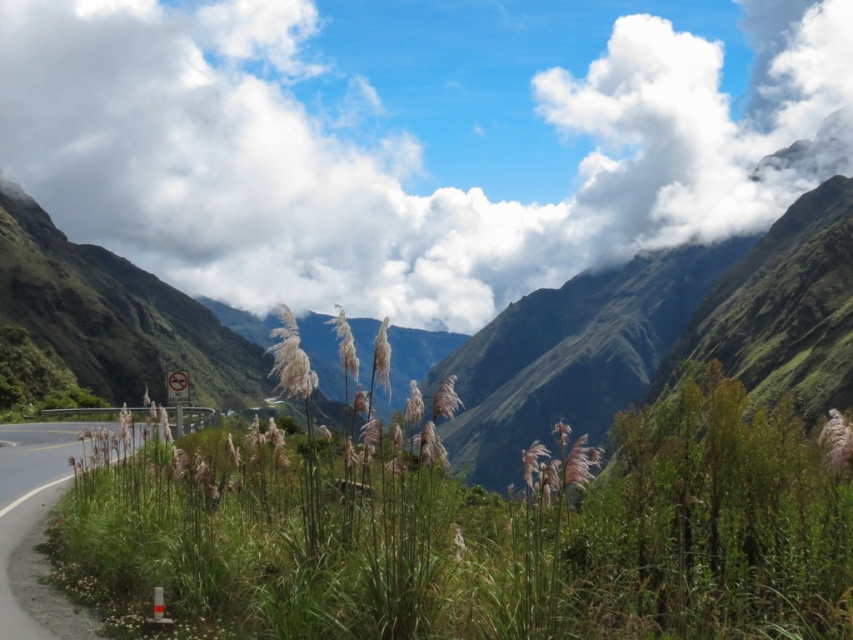
You are standing on the paved road near the guardrail and want to take a photo of the white fluffy cloud at upper center and the green grass at lower left. Which object should you point your camera towards first if you want to capture both in a single shot?

You should point your camera towards the green grass at lower left first because the white fluffy cloud at upper center is positioned on the right side of it, allowing both to be captured in the frame when framing from the left.

You are a hiker planning to take a photo of the white fluffy cloud at upper center and the green grass at lower left. Which object appears wider in the scene?

The white fluffy cloud at upper center appears wider than the green grass at lower left because its width surpasses that of the green grass at lower left.